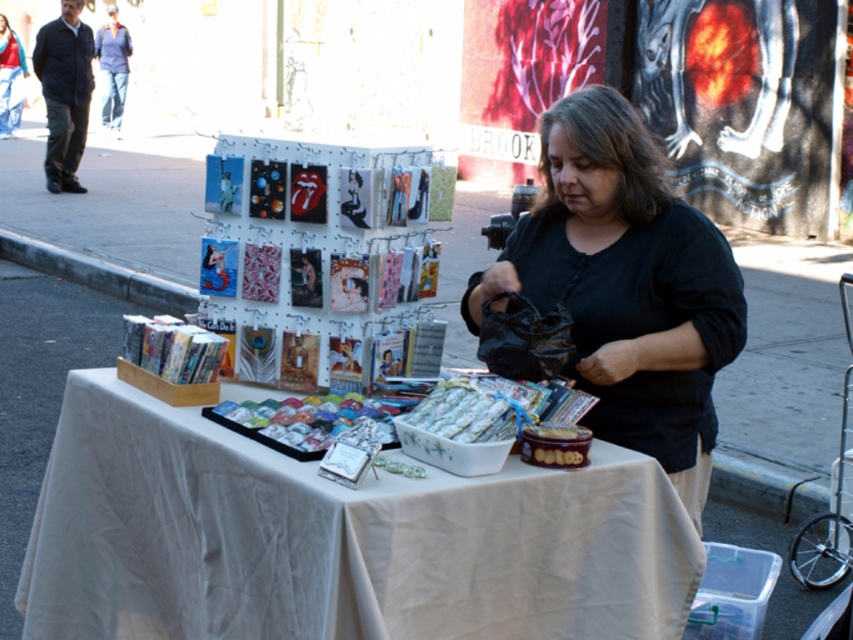
Question: Estimate the real-world distances between objects in this image. Which object is closer to the white glossy bowl at center?

Choices:
 (A) white cloth at center
 (B) black cotton shirt at center

Answer: (A)

Question: Can you confirm if black cotton shirt at center is wider than white glossy bowl at center?

Choices:
 (A) yes
 (B) no

Answer: (A)

Question: Based on their relative distances, which object is nearer to the black cotton shirt at center?

Choices:
 (A) white glossy bowl at center
 (B) white cloth at center
 (C) black leather jacket at upper left

Answer: (A)

Question: Can you confirm if white cloth at center is thinner than black leather jacket at upper left?

Choices:
 (A) no
 (B) yes

Answer: (A)

Question: Which of the following is the farthest from the observer?

Choices:
 (A) (77, 106)
 (B) (746, 321)
 (C) (62, 410)

Answer: (A)

Question: Is white cloth at center bigger than white glossy bowl at center?

Choices:
 (A) no
 (B) yes

Answer: (B)